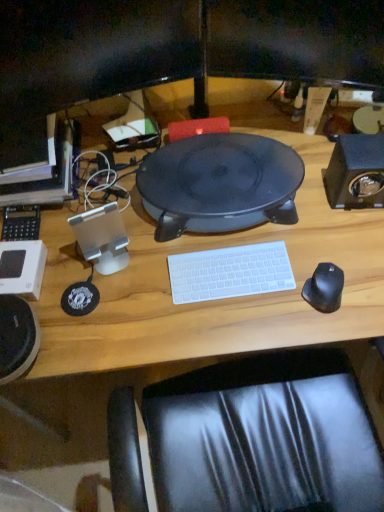
Locate an element on the screen. This screenshot has height=512, width=384. vacant area located to the right-hand side of black matte mouse at right is located at coordinates (362, 285).